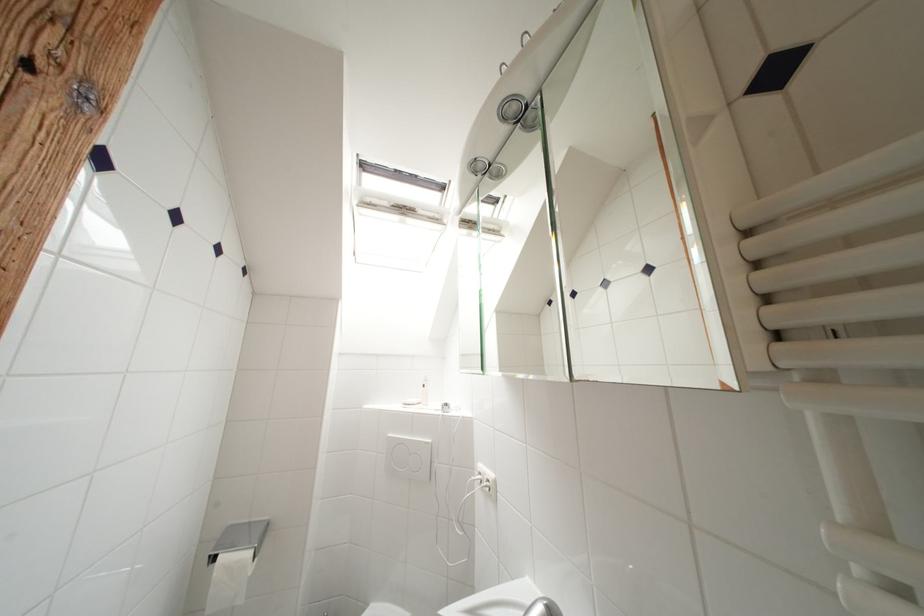
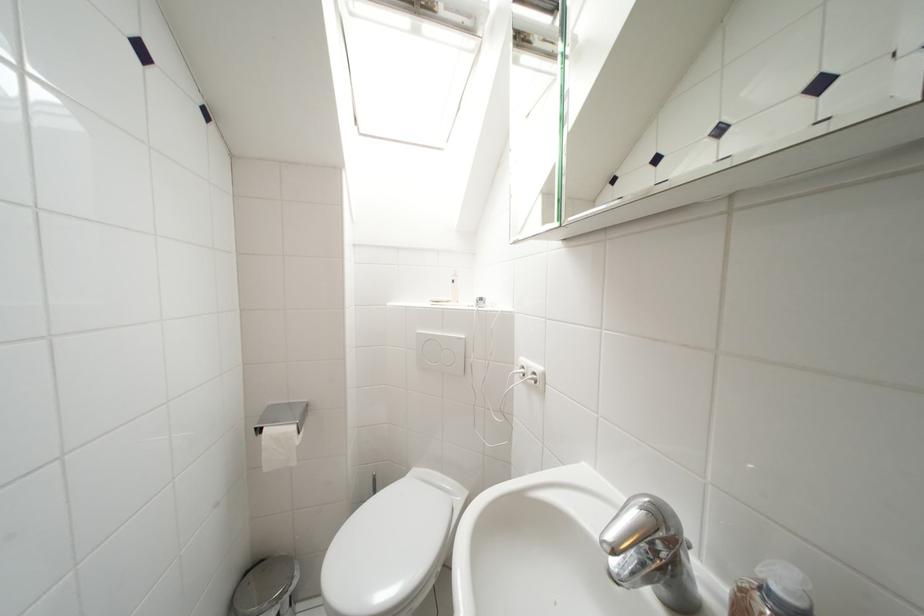
Where in the second image is the point corresponding to pixel 494 484 from the first image?

(541, 377)